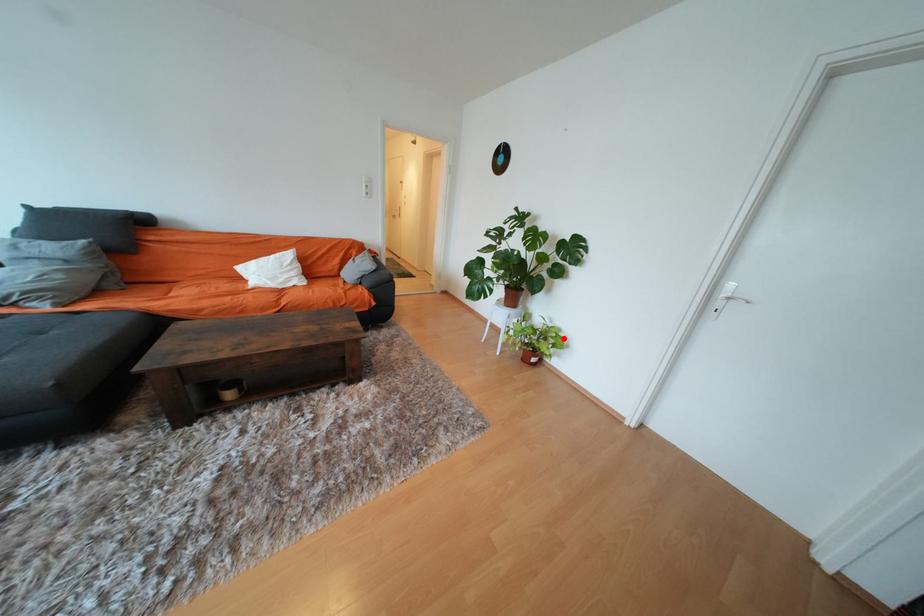
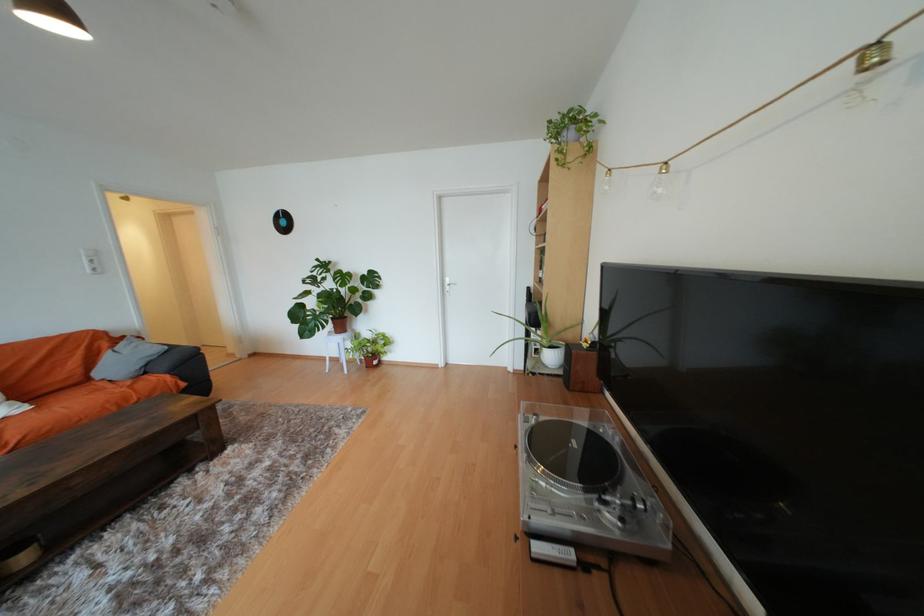
Question: I am providing you with two images of the same scene from different viewpoints. A red point is shown in image1. For the corresponding object point in image2, is it positioned nearer or farther from the camera?

Choices:
 (A) Nearer
 (B) Farther

Answer: (B)